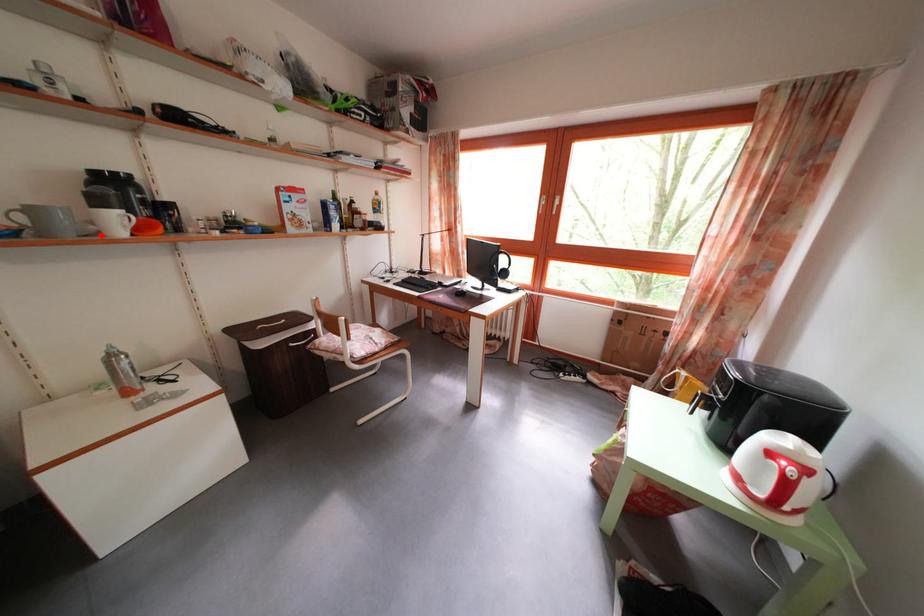
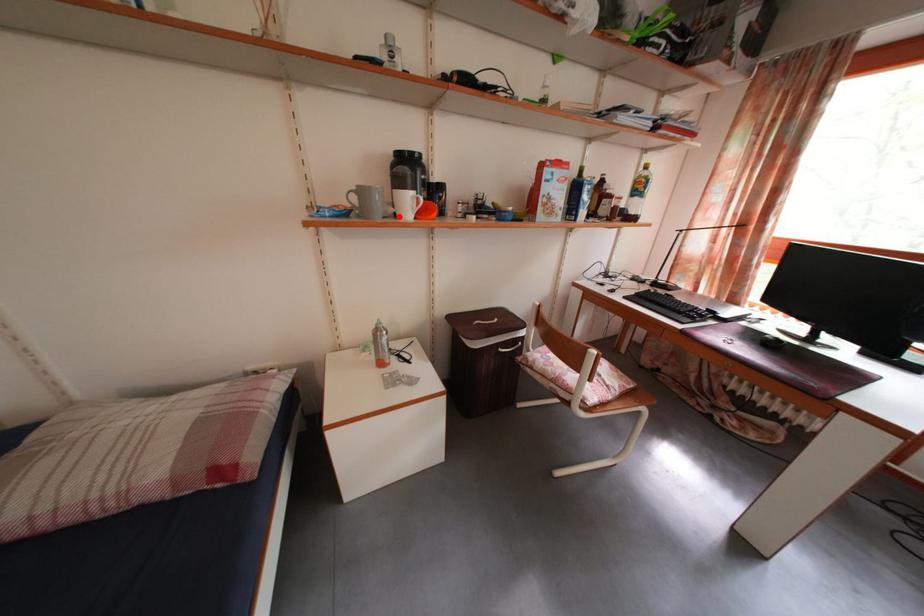
I am providing you with two images of the same scene from different viewpoints. A red point is marked on the first image and another point is marked on the second image. Is the red point in image1 aligned with the point shown in image2?

Yes